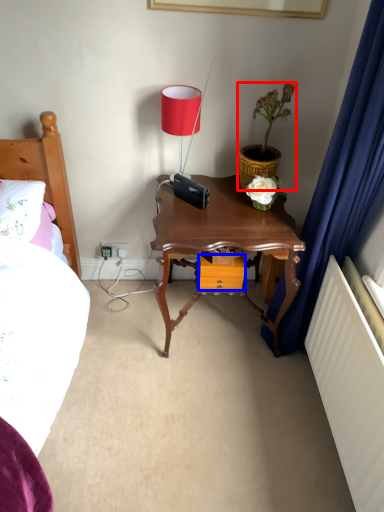
Question: Among these objects, which one is nearest to the camera, houseplant (highlighted by a red box) or drawer (highlighted by a blue box)?

Choices:
 (A) houseplant
 (B) drawer

Answer: (A)